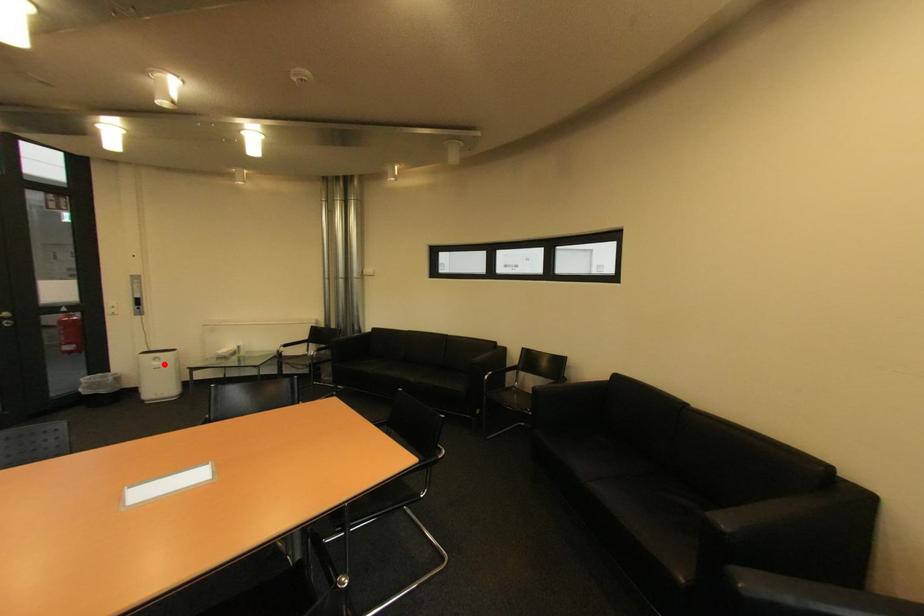
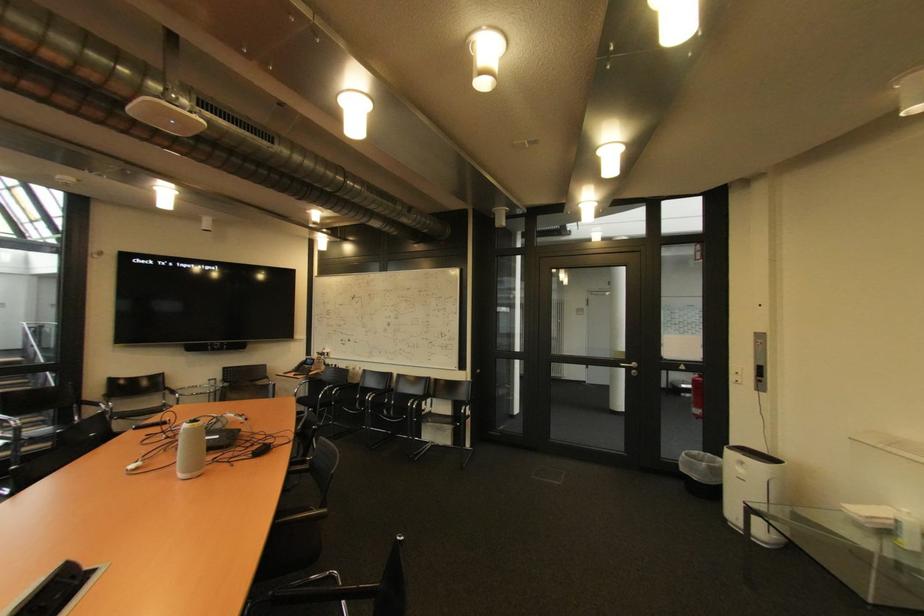
Locate, in the second image, the point that corresponds to the highlighted location in the first image.

(748, 471)